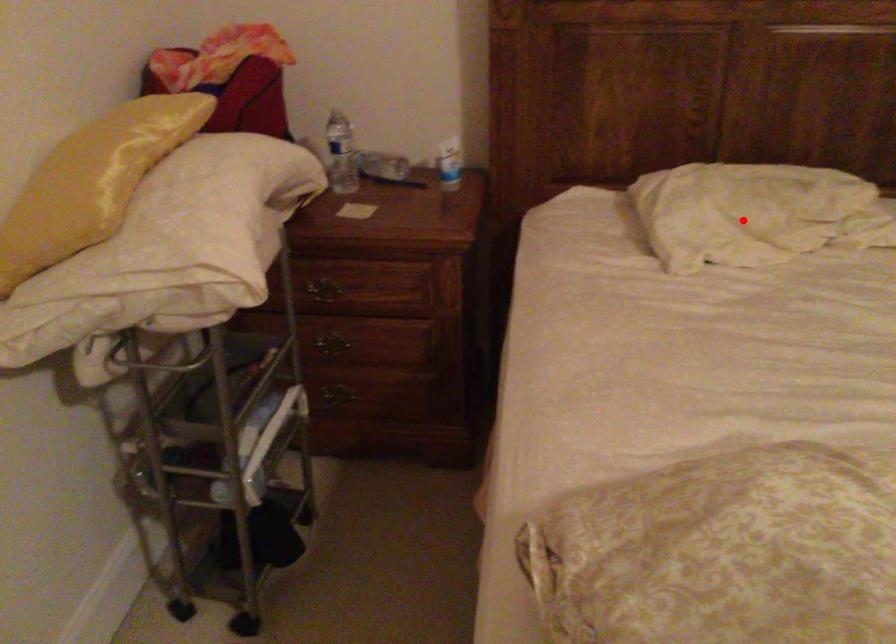
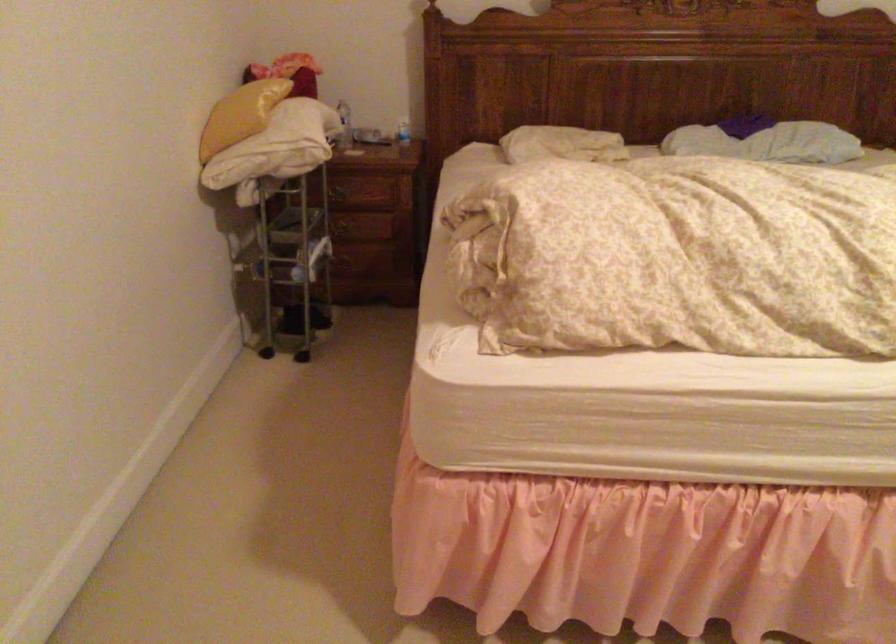
Where in the second image is the point corresponding to the highlighted location from the first image?

(561, 144)